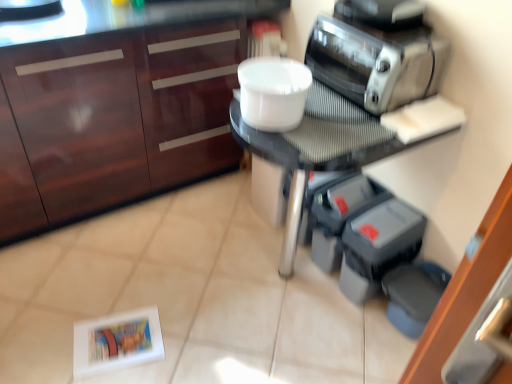
This screenshot has height=384, width=512. Find the location of `free space that is to the left of gray rubber dumbbells at lower right, arranged as the 2th appliance when viewed from the left`. free space that is to the left of gray rubber dumbbells at lower right, arranged as the 2th appliance when viewed from the left is located at coordinates (314, 294).